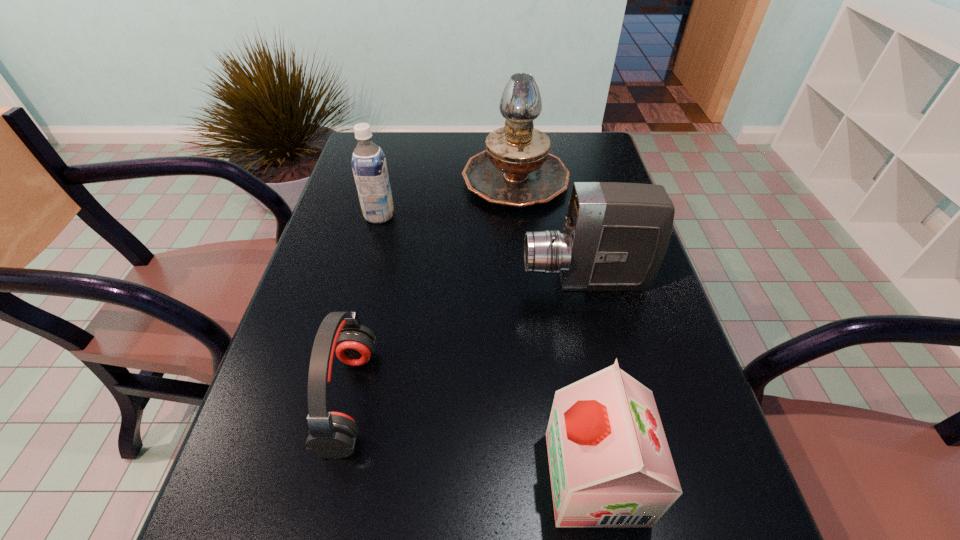
The image size is (960, 540). I want to click on free space between the oil lamp and the nearer soya milk, so click(555, 328).

Locate an element on the screen. empty space between the right soya milk and the oil lamp is located at coordinates (555, 328).

Where is `vacant space that is in between the left soya milk and the camcorder`? This screenshot has height=540, width=960. vacant space that is in between the left soya milk and the camcorder is located at coordinates pyautogui.click(x=482, y=248).

This screenshot has width=960, height=540. In order to click on empty location between the earphone and the right soya milk in this screenshot , I will do `click(472, 438)`.

At what (x,y) coordinates should I click in order to perform the action: click on unoccupied position between the shortest object and the right soya milk. Please return your answer as a coordinate pair (x, y). Looking at the image, I should click on (472, 438).

Identify the location of object that stands as the second closest to the third farthest object. 610,465.

You are a GUI agent. You are given a task and a screenshot of the screen. Output one action in this format:
    pyautogui.click(x=<x>, y=<y>)
    Task: Click on the object that is the fourth closest to the camcorder
    
    Given the screenshot: What is the action you would take?
    pyautogui.click(x=368, y=161)

This screenshot has width=960, height=540. In order to click on vacant space that satisfies the following two spatial constraints: 1. on the front side of the oil lamp; 2. on the label of the farther soya milk in this screenshot , I will do `click(519, 215)`.